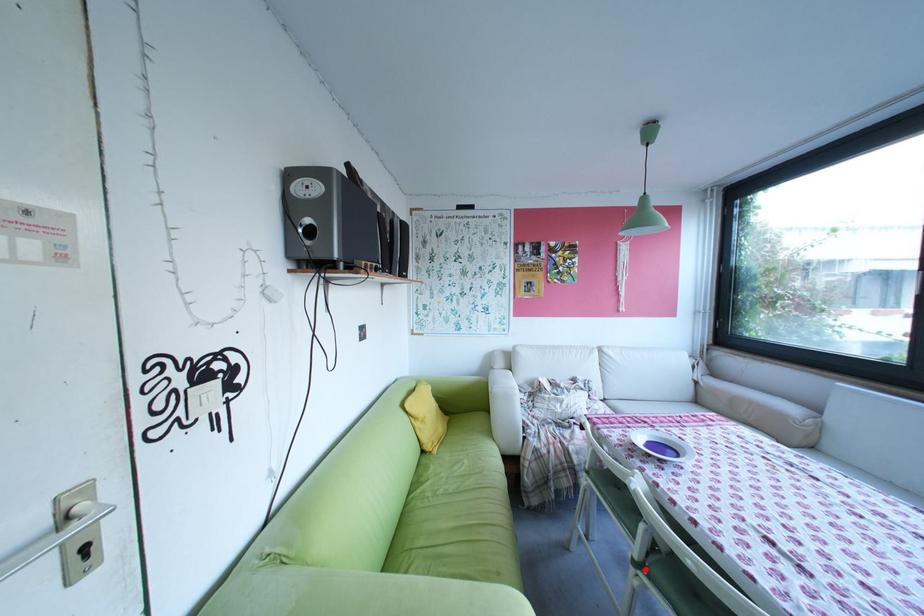
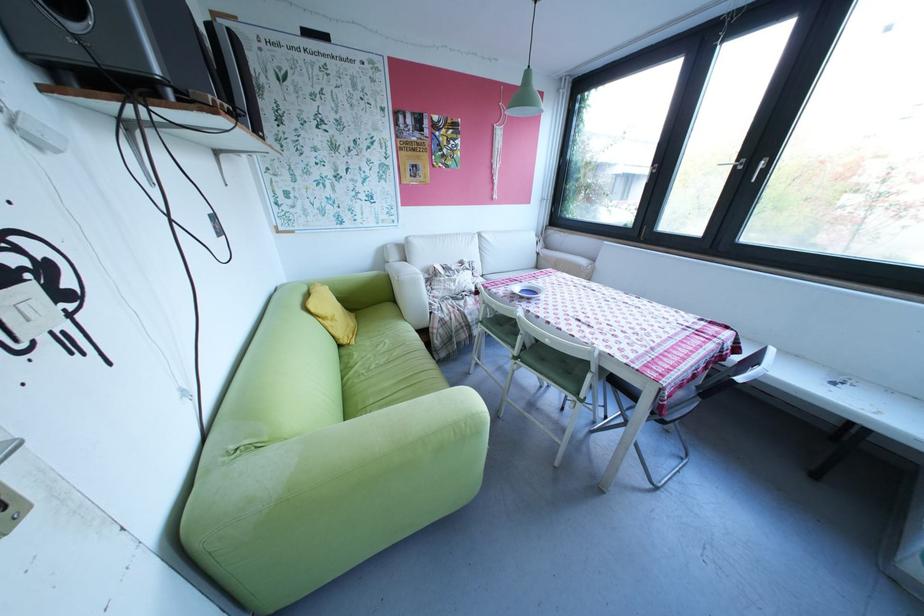
Locate, in the second image, the point that corresponds to the highlighted location in the first image.

(526, 361)